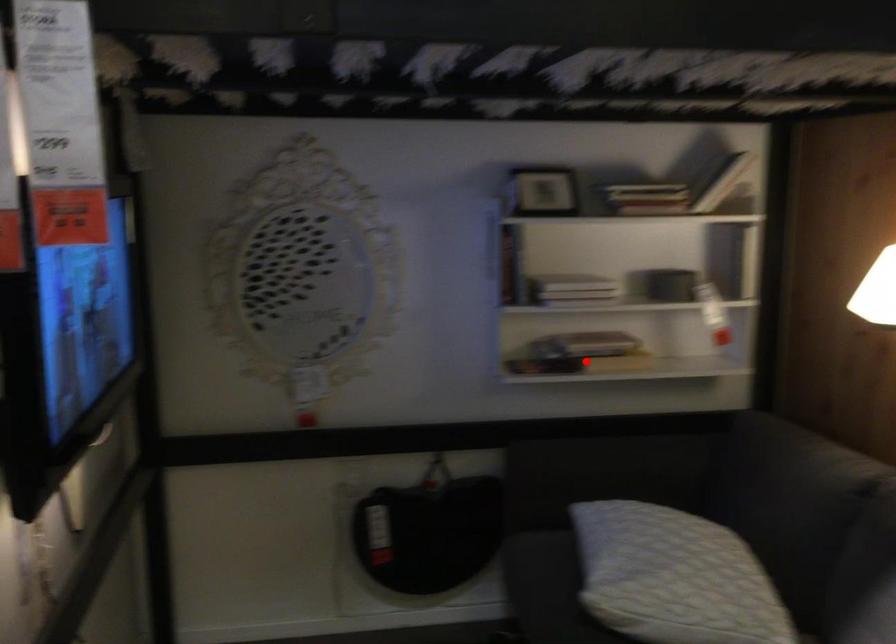
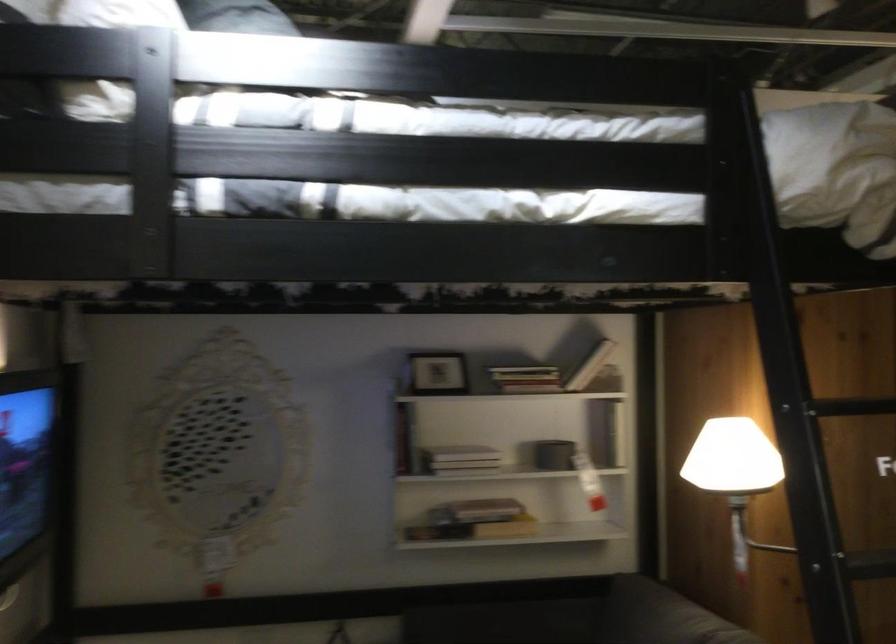
Locate, in the second image, the point that corresponds to the highlighted location in the first image.

(474, 529)